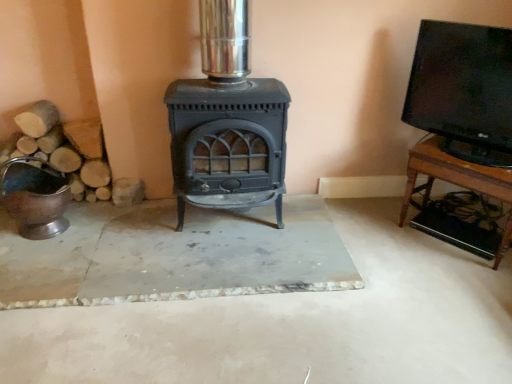
Locate an element on the screen. This screenshot has height=384, width=512. free location to the left of matte black wood burning stove at center is located at coordinates (137, 232).